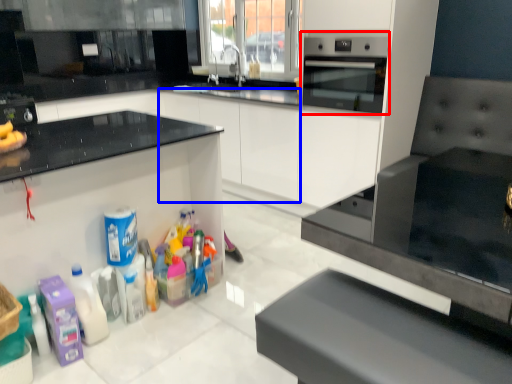
Question: Which object appears closest to the camera in this image, home appliance (highlighted by a red box) or cabinetry (highlighted by a blue box)?

Choices:
 (A) home appliance
 (B) cabinetry

Answer: (A)